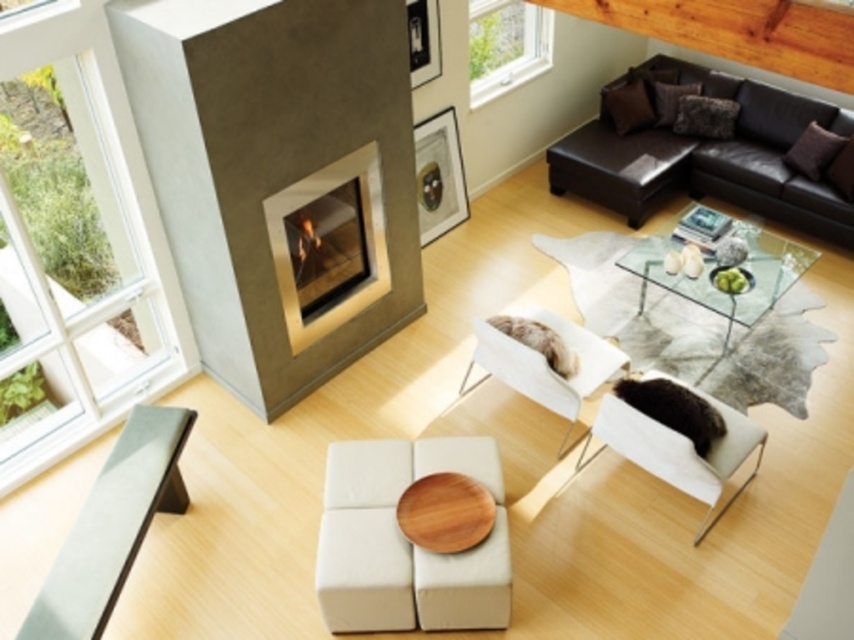
Between matte concrete fireplace at center and white leather armchair at center, which one has less height?

Standing shorter between the two is white leather armchair at center.

Who is taller, matte concrete fireplace at center or white leather armchair at center?

With more height is matte concrete fireplace at center.

Where is `matte concrete fireplace at center`? This screenshot has height=640, width=854. matte concrete fireplace at center is located at coordinates 278,176.

Image resolution: width=854 pixels, height=640 pixels. In order to click on matte concrete fireplace at center in this screenshot , I will do `click(278, 176)`.

Is white fabric armchair at lower right below matte glass fireplace at center?

Yes, white fabric armchair at lower right is below matte glass fireplace at center.

Locate an element on the screen. This screenshot has height=640, width=854. white fabric armchair at lower right is located at coordinates (682, 449).

How distant is matte concrete fireplace at center from white glass window at left?

matte concrete fireplace at center and white glass window at left are 35.48 inches apart from each other.

Between point (219, 314) and point (61, 282), which one is positioned in front?

Positioned in front is point (61, 282).

At what (x,y) coordinates should I click in order to perform the action: click on matte concrete fireplace at center. Please return your answer as a coordinate pair (x, y). Looking at the image, I should click on (278, 176).

Locate an element on the screen. The height and width of the screenshot is (640, 854). matte concrete fireplace at center is located at coordinates (278, 176).